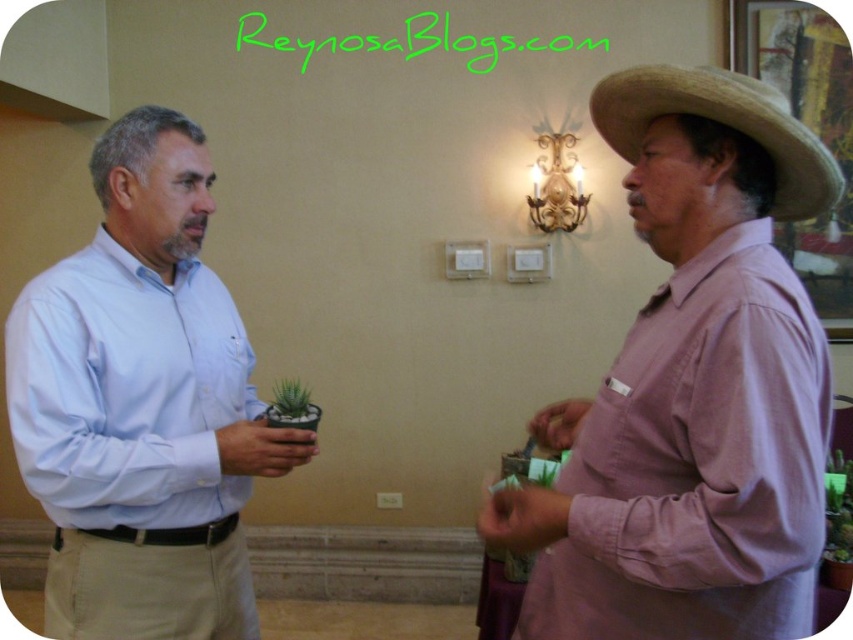
Does strawhat at right have a lesser width compared to green succulent at center?

In fact, strawhat at right might be wider than green succulent at center.

Is point (653, 99) positioned in front of point (294, 396)?

Yes.

Locate an element on the screen. strawhat at right is located at coordinates (721, 124).

Does pink cotton shirt at right appear on the right side of strawhat at right?

Incorrect, pink cotton shirt at right is not on the right side of strawhat at right.

Which of these two, pink cotton shirt at right or strawhat at right, stands taller?

pink cotton shirt at right

Is point (776, 541) positioned after point (759, 81)?

No, (776, 541) is closer to viewer.

Where is `pink cotton shirt at right`? This screenshot has width=853, height=640. pink cotton shirt at right is located at coordinates (691, 388).

Is pink cotton shirt at right positioned at the back of light blue shirt at left?

That is False.

Where is `pink cotton shirt at right`? The height and width of the screenshot is (640, 853). pink cotton shirt at right is located at coordinates (691, 388).